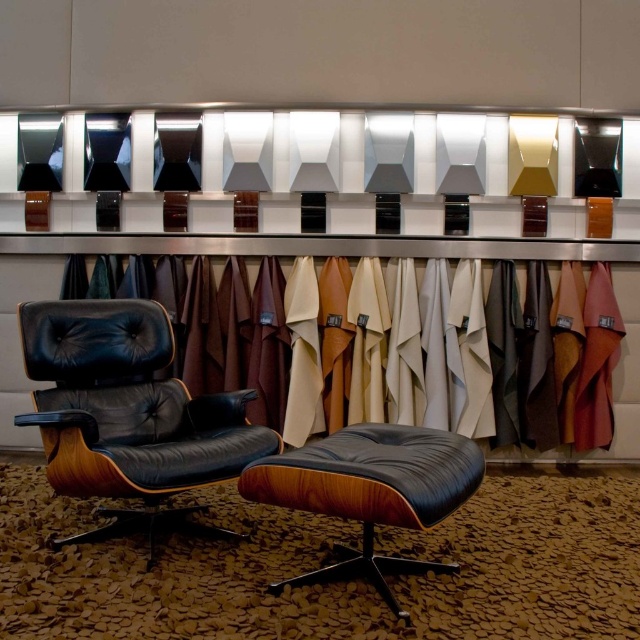
Can you confirm if black leather swivel chair at center is shorter than matte black leather ottoman at center?

In fact, black leather swivel chair at center may be taller than matte black leather ottoman at center.

Between black leather swivel chair at center and matte black leather ottoman at center, which one is positioned higher?

black leather swivel chair at center is higher up.

Is point (81, 474) farther from camera compared to point (355, 552)?

No, it is in front of (355, 552).

Locate an element on the screen. This screenshot has width=640, height=640. black leather swivel chair at center is located at coordinates (129, 413).

Which is in front, point (525, 426) or point (301, 573)?

Point (301, 573) is in front.

Can you confirm if leather at left is positioned to the left of matte black leather ottoman at center?

Incorrect, leather at left is not on the left side of matte black leather ottoman at center.

This screenshot has height=640, width=640. Identify the location of leather at left. (426, 352).

Locate an element on the screen. This screenshot has height=640, width=640. leather at left is located at coordinates (426, 352).

Can you confirm if black leather swivel chair at center is smaller than leather at left?

Incorrect, black leather swivel chair at center is not smaller in size than leather at left.

Between point (104, 394) and point (385, 273), which one is positioned in front?

Positioned in front is point (104, 394).

Where is `black leather swivel chair at center`? The height and width of the screenshot is (640, 640). black leather swivel chair at center is located at coordinates (129, 413).